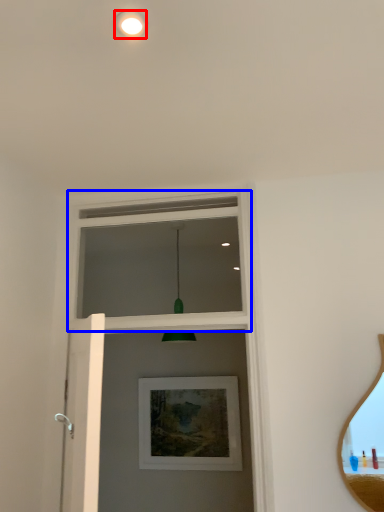
Question: Which object appears farthest to the camera in this image, droplight (highlighted by a red box) or window frame (highlighted by a blue box)?

Choices:
 (A) droplight
 (B) window frame

Answer: (B)